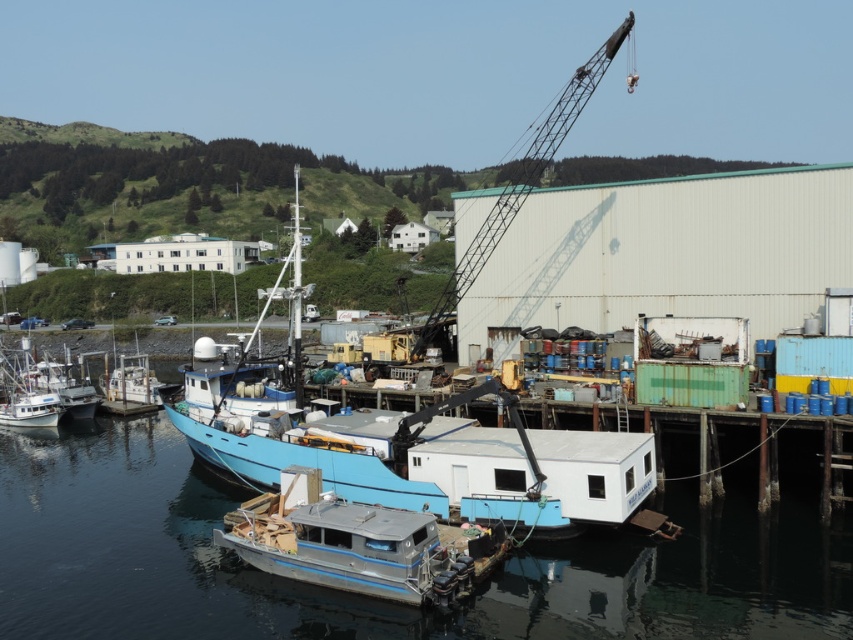
Does transparent blue water at lower center appear under metallic gray pontoon boat at center?

Correct, transparent blue water at lower center is located below metallic gray pontoon boat at center.

Who is more forward, (x=265, y=604) or (x=218, y=541)?

Positioned in front is point (x=265, y=604).

Where is `transparent blue water at lower center`? This screenshot has height=640, width=853. transparent blue water at lower center is located at coordinates (367, 596).

Which of these two, metallic gray pontoon boat at center or blue matte boat at center, stands shorter?

metallic gray pontoon boat at center

Describe the element at coordinates (358, 544) in the screenshot. I see `metallic gray pontoon boat at center` at that location.

Does point (383, 529) lie behind point (532, 502)?

No, it is not.

At what (x,y) coordinates should I click in order to perform the action: click on metallic gray pontoon boat at center. Please return your answer as a coordinate pair (x, y). Looking at the image, I should click on (358, 544).

Is metallic gray pontoon boat at center smaller than metallic gray crane at center?

Yes.

The height and width of the screenshot is (640, 853). Describe the element at coordinates (358, 544) in the screenshot. I see `metallic gray pontoon boat at center` at that location.

Locate an element on the screen. metallic gray pontoon boat at center is located at coordinates (358, 544).